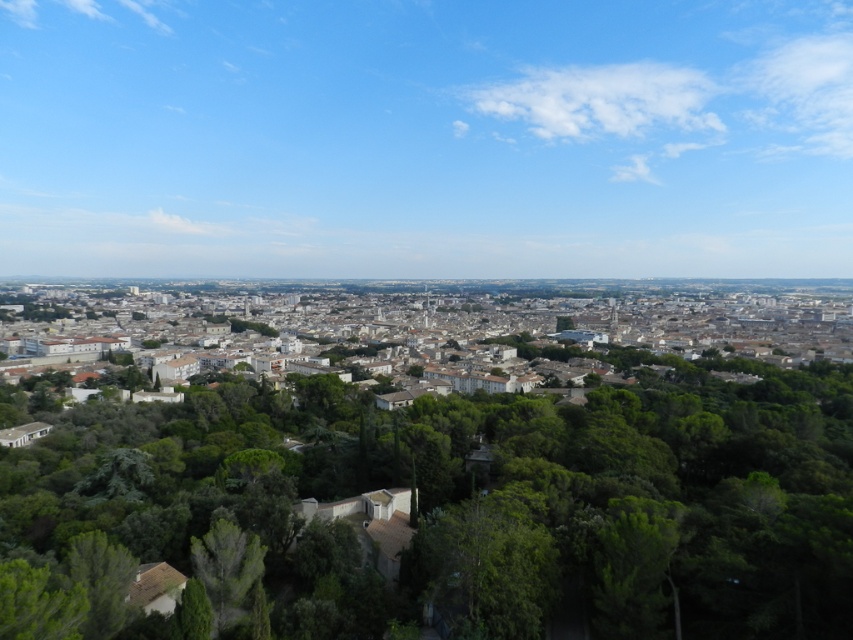
Does green leafy tree at center appear over green leafy tree at lower left?

Correct, green leafy tree at center is located above green leafy tree at lower left.

Between green leafy tree at center and green leafy tree at lower left, which one appears on the right side from the viewer's perspective?

green leafy tree at center

Image resolution: width=853 pixels, height=640 pixels. I want to click on green leafy tree at center, so click(x=456, y=506).

Can you confirm if green leafy tree at center is smaller than white concrete buildings at center?

Yes, green leafy tree at center is smaller than white concrete buildings at center.

Who is more forward, (349,392) or (461,380)?

Positioned in front is point (349,392).

The height and width of the screenshot is (640, 853). I want to click on green leafy tree at center, so click(456, 506).

Does white concrete buildings at center appear over green leafy tree at lower left?

Yes.

How distant is white concrete buildings at center from green leafy tree at lower left?

250.99 meters

This screenshot has width=853, height=640. I want to click on white concrete buildings at center, so click(427, 332).

This screenshot has width=853, height=640. Identify the location of white concrete buildings at center. click(427, 332).